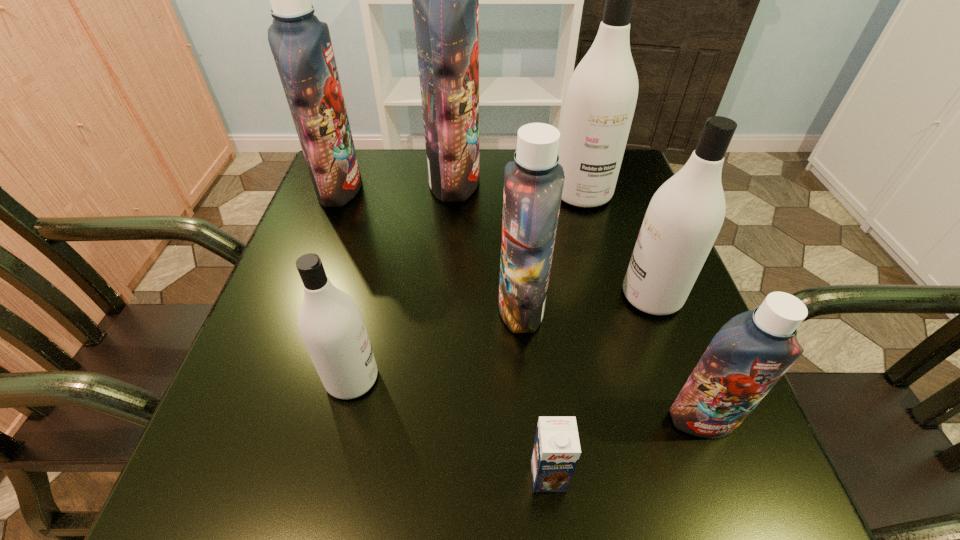
The width and height of the screenshot is (960, 540). What are the coordinates of `the sixth closest object to the second biggest white shampoo` in the screenshot? It's located at (330, 322).

This screenshot has width=960, height=540. I want to click on shampoo that is the second closest to the second farthest white shampoo, so click(x=750, y=353).

Where is `shampoo identified as the fourth closest to the third blue shampoo from right to left`? shampoo identified as the fourth closest to the third blue shampoo from right to left is located at coordinates (684, 217).

Locate which blue shampoo ranks third in proximity to the tallest shampoo. Please provide its 2D coordinates. Your answer should be formatted as a tuple, i.e. [(x, y)], where the tuple contains the x and y coordinates of a point satisfying the conditions above.

[(750, 353)]

Select which blue shampoo is the closest to the second nearest white shampoo. Please provide its 2D coordinates. Your answer should be formatted as a tuple, i.e. [(x, y)], where the tuple contains the x and y coordinates of a point satisfying the conditions above.

[(533, 183)]

I want to click on white shampoo that stands as the third closest to the shortest object, so click(601, 97).

The width and height of the screenshot is (960, 540). Find the location of `white shampoo that is the closest to the rightmost blue shampoo`. white shampoo that is the closest to the rightmost blue shampoo is located at coordinates (684, 217).

The image size is (960, 540). Find the location of `blank area in the image that satisfies the following two spatial constraints: 1. on the front-facing side of the biggest white shampoo; 2. on the front label of the second nearest blue shampoo`. blank area in the image that satisfies the following two spatial constraints: 1. on the front-facing side of the biggest white shampoo; 2. on the front label of the second nearest blue shampoo is located at coordinates (613, 307).